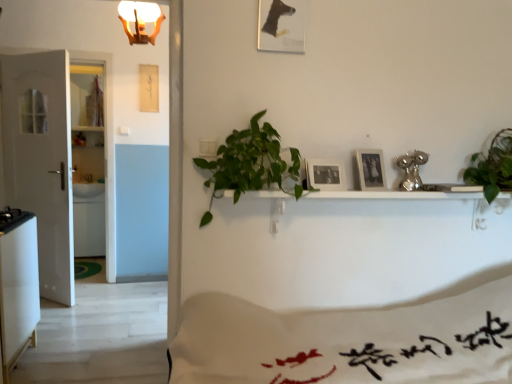
Question: Does black matte picture frame at center, arranged as the first picture frame when ordered from the bottom, appear on the left side of white glossy refrigerator at lower left?

Choices:
 (A) yes
 (B) no

Answer: (B)

Question: From a real-world perspective, is black matte picture frame at center, arranged as the first picture frame when ordered from the bottom, located beneath white glossy refrigerator at lower left?

Choices:
 (A) yes
 (B) no

Answer: (B)

Question: Does black matte picture frame at center, the 2th picture frame positioned from the right, come in front of white glossy refrigerator at lower left?

Choices:
 (A) no
 (B) yes

Answer: (B)

Question: From the image's perspective, is black matte picture frame at center, which is the third picture frame from top to bottom, beneath white glossy refrigerator at lower left?

Choices:
 (A) no
 (B) yes

Answer: (A)

Question: Is black matte picture frame at center, arranged as the first picture frame when ordered from the bottom, completely or partially outside of white glossy refrigerator at lower left?

Choices:
 (A) no
 (B) yes

Answer: (B)

Question: From a real-world perspective, is white glossy refrigerator at lower left physically located above or below black matte picture frame at center, arranged as the first picture frame when ordered from the bottom?

Choices:
 (A) below
 (B) above

Answer: (A)

Question: Considering the positions of white glossy refrigerator at lower left and black matte picture frame at center, which is the third picture frame from top to bottom, in the image, is white glossy refrigerator at lower left taller or shorter than black matte picture frame at center, which is the third picture frame from top to bottom,?

Choices:
 (A) short
 (B) tall

Answer: (B)

Question: Based on their positions, is white glossy refrigerator at lower left located to the left or right of black matte picture frame at center, arranged as the first picture frame when ordered from the bottom?

Choices:
 (A) right
 (B) left

Answer: (B)

Question: Considering their positions, is white glossy refrigerator at lower left located in front of or behind black matte picture frame at center, arranged as the first picture frame when ordered from the bottom?

Choices:
 (A) behind
 (B) front

Answer: (A)

Question: Choose the correct answer: Is green leafy plant at center, arranged as the 2th houseplant when viewed from the right, inside white matte door at left or outside it?

Choices:
 (A) inside
 (B) outside

Answer: (B)

Question: Considering the positions of green leafy plant at center, the 1th houseplant in the left-to-right sequence, and white matte door at left in the image, is green leafy plant at center, the 1th houseplant in the left-to-right sequence, wider or thinner than white matte door at left?

Choices:
 (A) wide
 (B) thin

Answer: (A)

Question: From a real-world perspective, relative to white matte door at left, is green leafy plant at center, the 1th houseplant in the left-to-right sequence, vertically above or below?

Choices:
 (A) above
 (B) below

Answer: (A)

Question: Is green leafy plant at center, the 1th houseplant in the left-to-right sequence, to the left or to the right of white matte door at left in the image?

Choices:
 (A) right
 (B) left

Answer: (A)

Question: From the image's perspective, is white glossy refrigerator at lower left positioned above or below matte wooden picture frame at upper center, acting as the third picture frame starting from the left?

Choices:
 (A) above
 (B) below

Answer: (B)

Question: Is white glossy refrigerator at lower left wider or thinner than matte wooden picture frame at upper center, acting as the third picture frame starting from the left?

Choices:
 (A) thin
 (B) wide

Answer: (B)